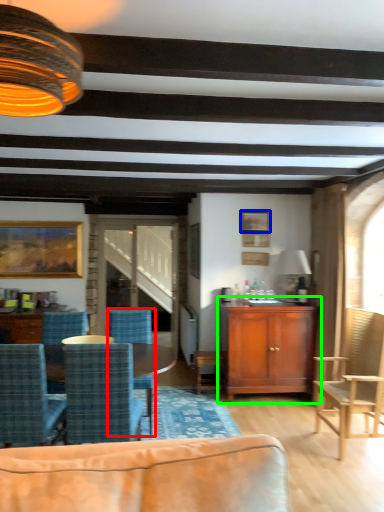
Question: Based on their relative distances, which object is farther from chair (highlighted by a red box)? Choose from picture frame (highlighted by a blue box) and cabinetry (highlighted by a green box).

Choices:
 (A) picture frame
 (B) cabinetry

Answer: (A)